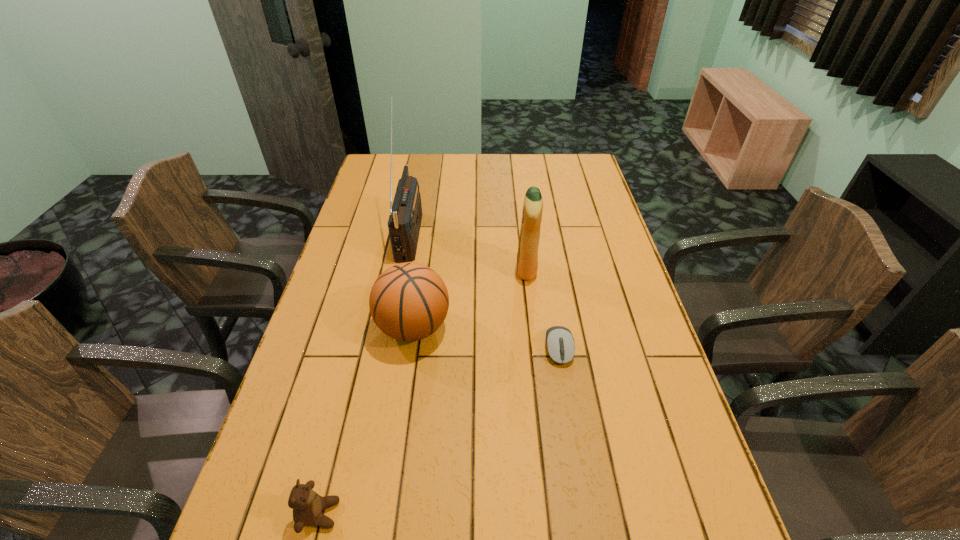
Find the location of `unoccupied position between the shortest object and the fourth shortest object`. unoccupied position between the shortest object and the fourth shortest object is located at coordinates [542, 309].

Select which object appears as the third closest to the shortest object. Please provide its 2D coordinates. Your answer should be formatted as a tuple, i.e. [(x, y)], where the tuple contains the x and y coordinates of a point satisfying the conditions above.

[(404, 222)]

The width and height of the screenshot is (960, 540). I want to click on object that can be found as the closest to the computer equipment, so click(527, 256).